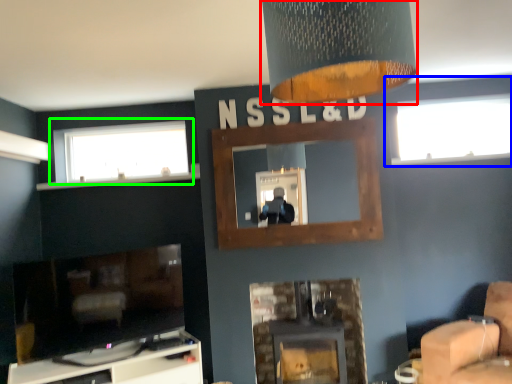
Question: Based on their relative distances, which object is nearer to lamp (highlighted by a red box)? Choose from window (highlighted by a blue box) and window (highlighted by a green box).

Choices:
 (A) window
 (B) window

Answer: (B)